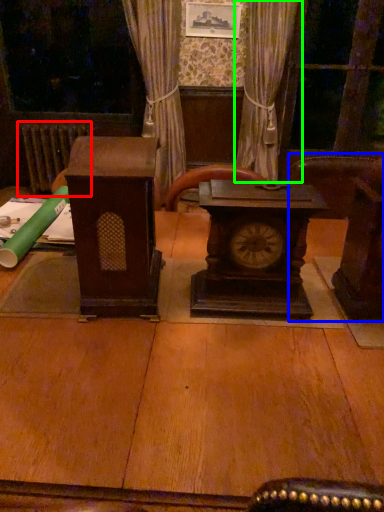
Question: Which object is positioned farthest from radiator (highlighted by a red box)? Select from furniture (highlighted by a blue box) and curtain (highlighted by a green box).

Choices:
 (A) furniture
 (B) curtain

Answer: (A)